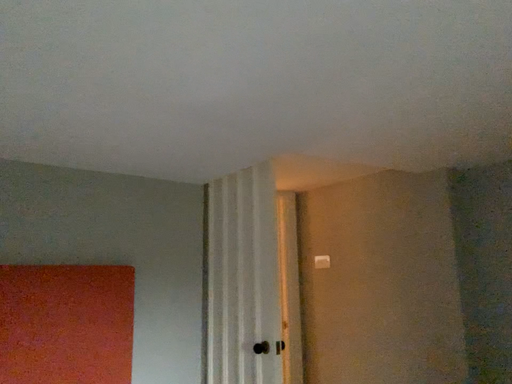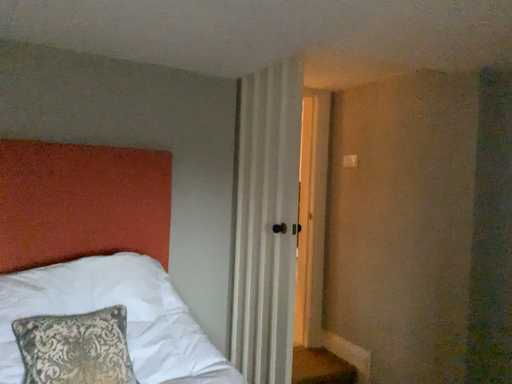
Question: How did the camera likely rotate when shooting the video?

Choices:
 (A) rotated downward
 (B) rotated upward

Answer: (A)